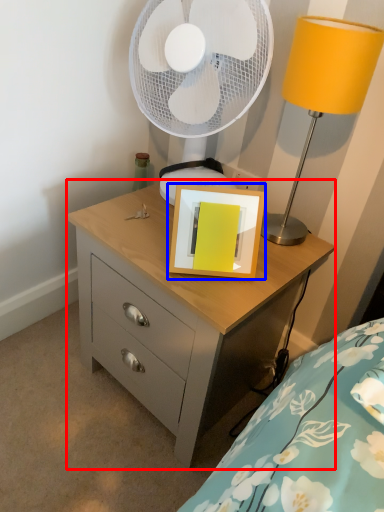
Question: Among these objects, which one is nearest to the camera, chest of drawers (highlighted by a red box) or picture frame (highlighted by a blue box)?

Choices:
 (A) chest of drawers
 (B) picture frame

Answer: (A)